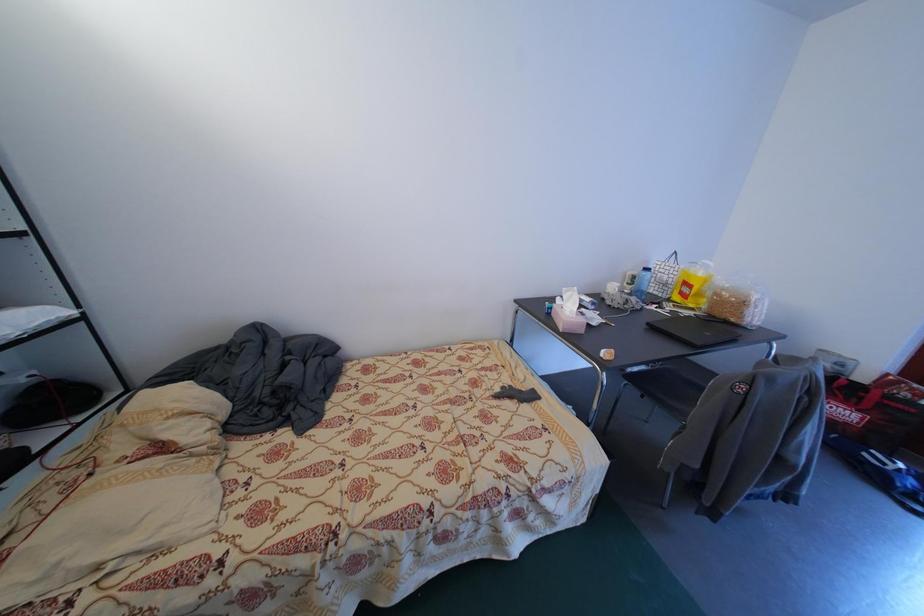
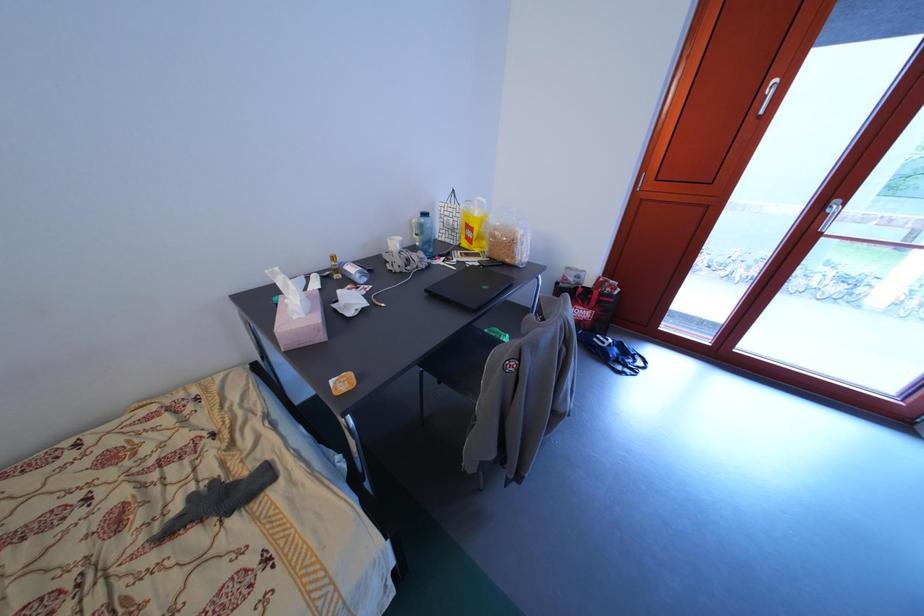
Question: Based on the continuous images, in which direction is the camera rotating? Reply with the corresponding letter.

Choices:
 (A) Left
 (B) Right
 (C) Up
 (D) Down

Answer: (B)